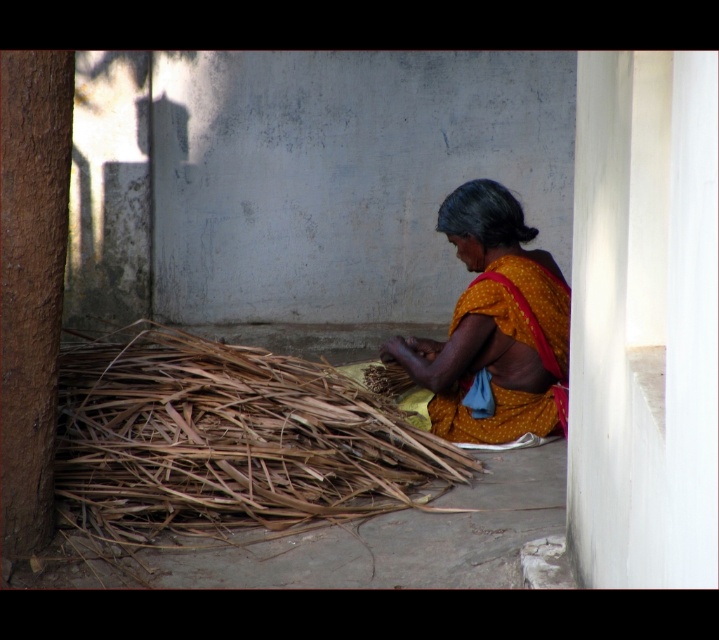
Question: Can you confirm if brown dry reed at lower left is bigger than yellow dotted fabric at center?

Choices:
 (A) yes
 (B) no

Answer: (A)

Question: Which of the following is the closest to the observer?

Choices:
 (A) brown dry reed at lower left
 (B) yellow dotted fabric at center

Answer: (A)

Question: Which point appears closest to the camera in this image?

Choices:
 (A) (383, 353)
 (B) (459, 481)

Answer: (B)

Question: Which point is farther to the camera?

Choices:
 (A) (127, 394)
 (B) (485, 193)

Answer: (B)

Question: From the image, what is the correct spatial relationship of brown dry reed at lower left in relation to yellow dotted fabric at center?

Choices:
 (A) right
 (B) left

Answer: (B)

Question: Can you confirm if brown dry reed at lower left is bigger than yellow dotted fabric at center?

Choices:
 (A) no
 (B) yes

Answer: (B)